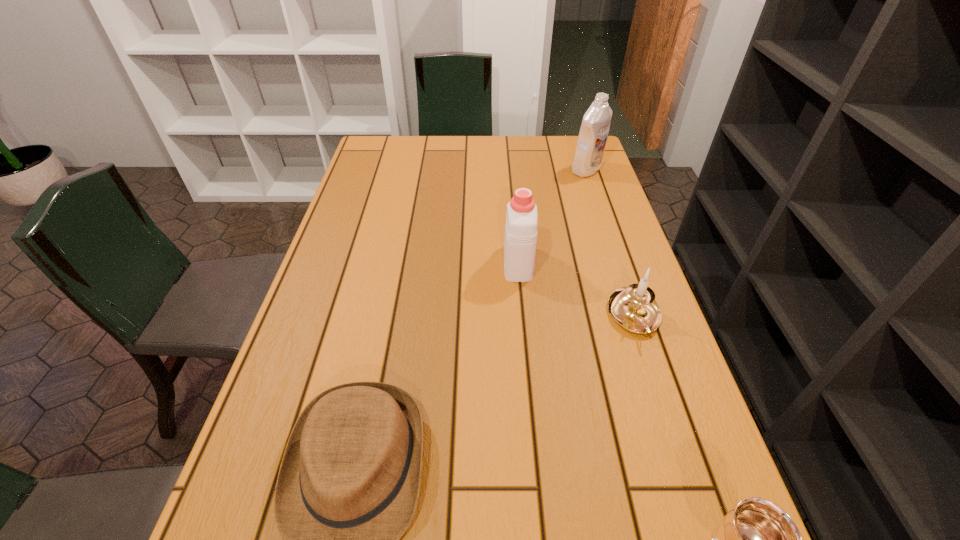
Where is `the farthest object`? This screenshot has width=960, height=540. the farthest object is located at coordinates (595, 126).

The image size is (960, 540). Identify the location of the farther detergent. (595, 126).

This screenshot has height=540, width=960. Identify the location of the fourth shortest object. coord(521,223).

The width and height of the screenshot is (960, 540). I want to click on the left detergent, so click(x=521, y=223).

Where is `candle holder`? candle holder is located at coordinates (634, 308).

Identify the location of vacant space positioned 0.090m on the front of the farther detergent. Image resolution: width=960 pixels, height=540 pixels. (595, 195).

What are the coordinates of `free space located on the handle side of the second object from left to right` in the screenshot? It's located at (512, 193).

The width and height of the screenshot is (960, 540). In order to click on vacant space located on the handle side of the second object from left to right in this screenshot , I will do `click(513, 209)`.

Locate an element on the screen. vacant point located 0.190m on the handle side of the second object from left to right is located at coordinates (512, 203).

The height and width of the screenshot is (540, 960). Identify the location of vacant space located on the handle side of the candle holder. (699, 511).